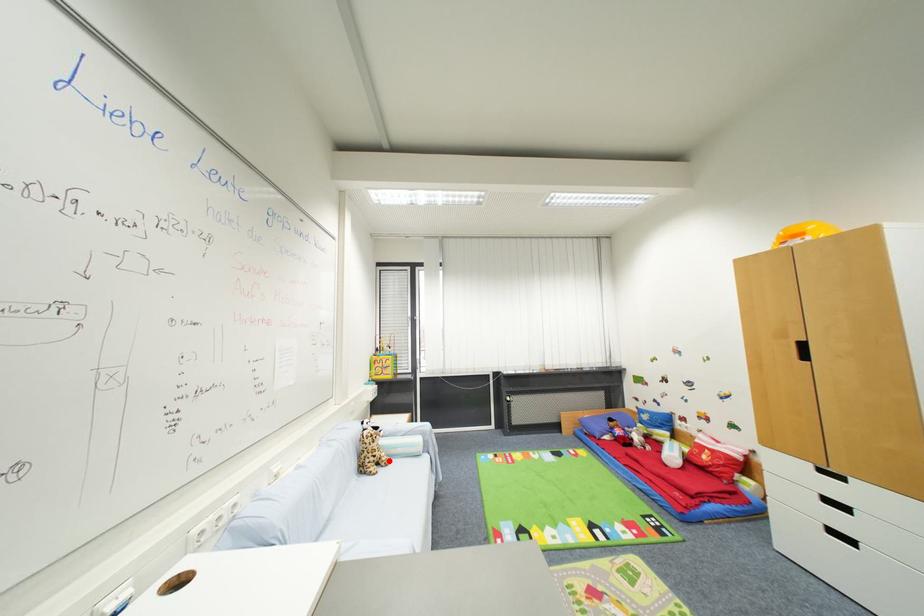
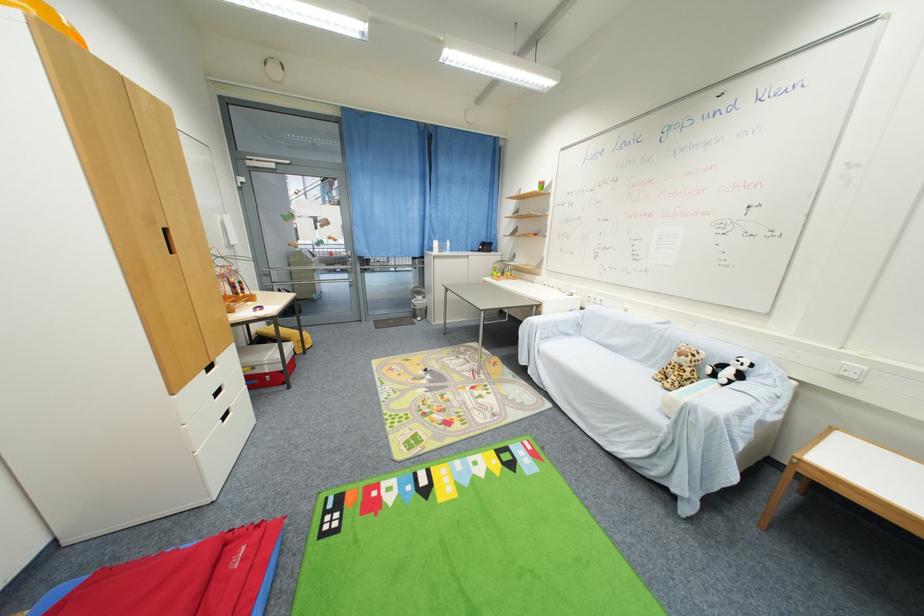
In the second image, find the point that corresponds to the highlighted location in the first image.

(675, 382)